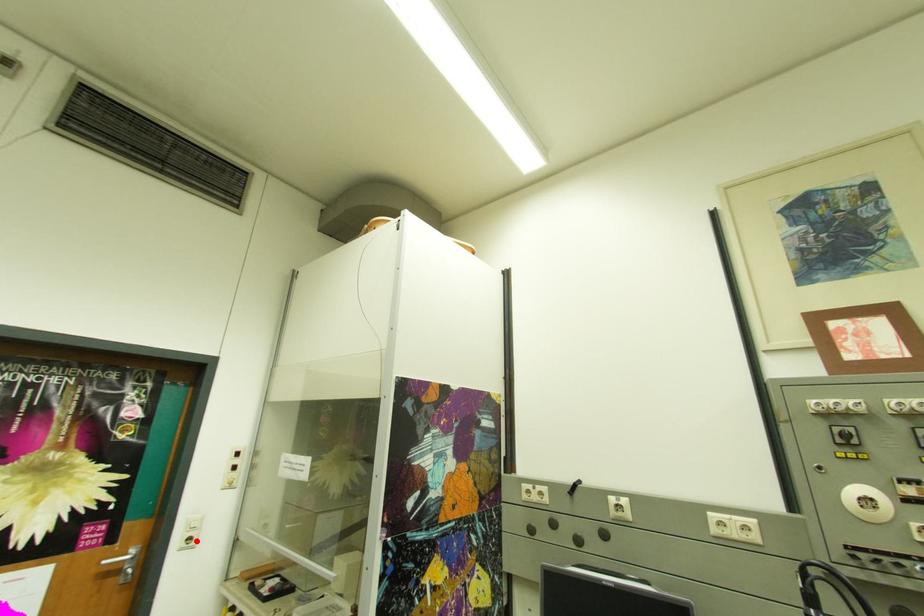
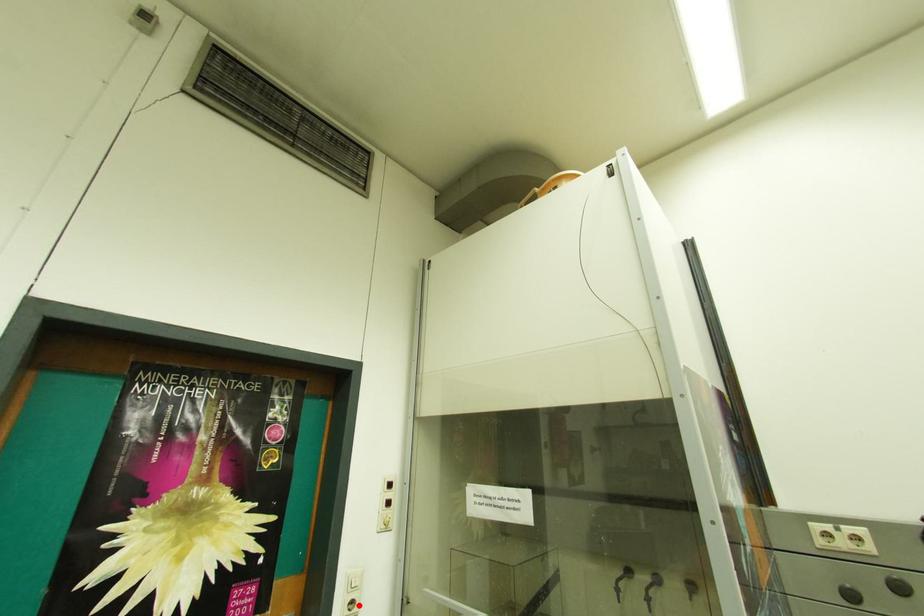
I am providing you with two images of the same scene from different viewpoints. A red point is marked on the first image and another point is marked on the second image. Is the marked point in image1 the same physical position as the marked point in image2?

Yes